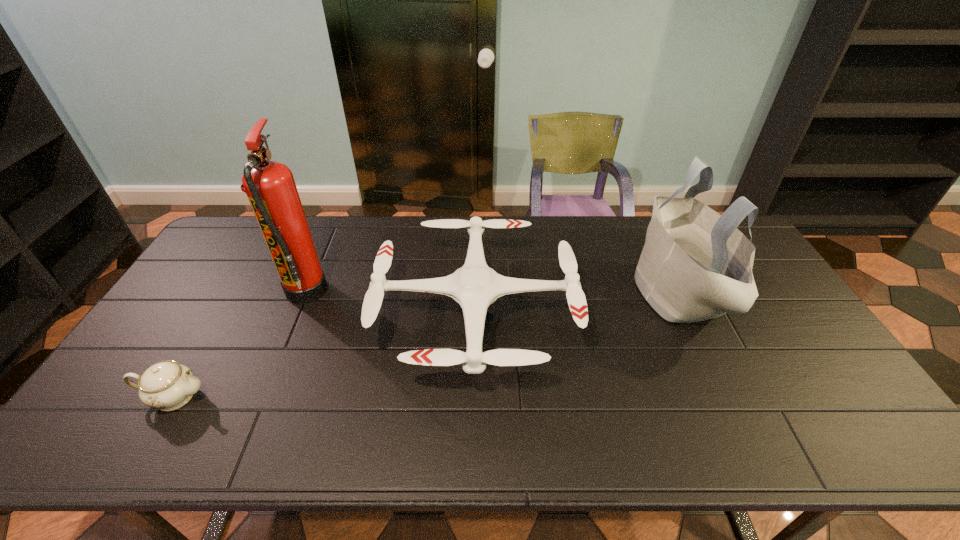
What are the coordinates of `free space located 0.140m with the camera attached at the bottom of the second shortest object` in the screenshot? It's located at (623, 313).

Image resolution: width=960 pixels, height=540 pixels. I want to click on free point located 0.140m at the spout of the shortest object, so click(x=265, y=397).

This screenshot has width=960, height=540. In order to click on shopping bag located in the far edge section of the desktop in this screenshot , I will do `click(695, 265)`.

This screenshot has height=540, width=960. What are the coordinates of `drone at the far edge` in the screenshot? It's located at (474, 286).

Locate an element on the screen. object that is at the left edge is located at coordinates (167, 385).

The height and width of the screenshot is (540, 960). What are the coordinates of `free space at the far edge of the desktop` in the screenshot? It's located at (372, 240).

In the image, there is a desktop. Find the location of `vacant space at the near edge`. vacant space at the near edge is located at coordinates (686, 421).

Locate an element on the screen. The height and width of the screenshot is (540, 960). vacant space at the left edge of the desktop is located at coordinates (227, 286).

Where is `free space at the right edge`? The width and height of the screenshot is (960, 540). free space at the right edge is located at coordinates coord(778,354).

Where is `vacant space at the far left corner of the desktop`? The image size is (960, 540). vacant space at the far left corner of the desktop is located at coordinates (255, 218).